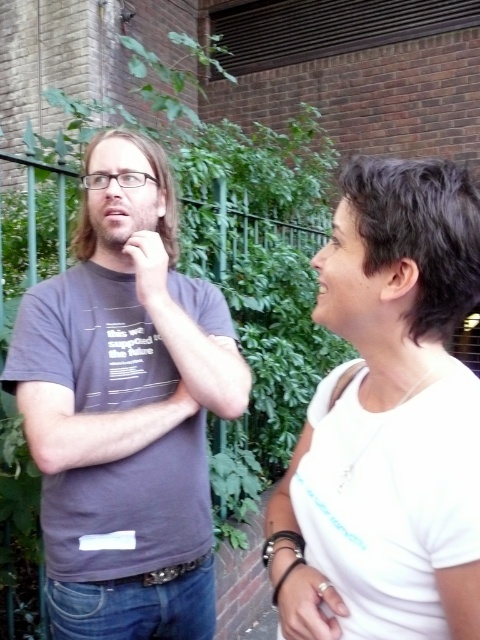
You are standing at the point with coordinates point (103,195) and want to walk to the point with coordinates point (328,248). Given the scene described, will you be moving towards the brick wall or away from it?

Point (103,195) is behind point (328,248). Since you are moving from a point behind to a point in front, you will be moving away from the brick wall.

You are a photographer taking a portrait of two people. You notice both the matte black nose at center and the matte skin nose at center. Which nose appears thinner in the photo?

The matte black nose at center appears thinner than the matte skin nose at center in the photo.